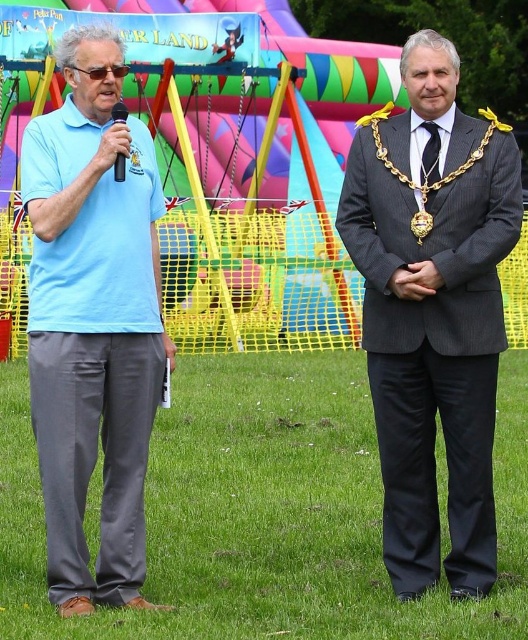
Is dark gray pinstripe suit at center wider than light blue cotton shirt at left?

Yes, dark gray pinstripe suit at center is wider than light blue cotton shirt at left.

Can you confirm if dark gray pinstripe suit at center is positioned to the right of light blue cotton shirt at left?

Correct, you'll find dark gray pinstripe suit at center to the right of light blue cotton shirt at left.

At what (x,y) coordinates should I click in order to perform the action: click on dark gray pinstripe suit at center. Please return your answer as a coordinate pair (x, y). The image size is (528, 640). Looking at the image, I should click on (432, 316).

Identify the location of dark gray pinstripe suit at center. (432, 316).

Which of these two, light blue cotton shirt at left or black plastic microphone at left, stands shorter?

black plastic microphone at left is shorter.

Who is positioned more to the right, light blue cotton shirt at left or black plastic microphone at left?

black plastic microphone at left is more to the right.

Locate an element on the screen. light blue cotton shirt at left is located at coordinates point(92,323).

Who is more forward, (426,122) or (110,109)?

Point (110,109)

Is black silk tie at center positioned before black plastic microphone at left?

No.

Measure the distance between point (431, 124) and camera.

Point (431, 124) is 11.48 meters away from camera.

Identify the location of black silk tie at center. (429, 154).